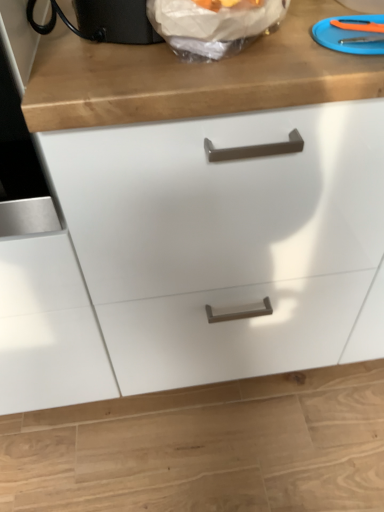
Where is `spots to the right of white paper bag at upper center`? This screenshot has height=512, width=384. spots to the right of white paper bag at upper center is located at coordinates (331, 28).